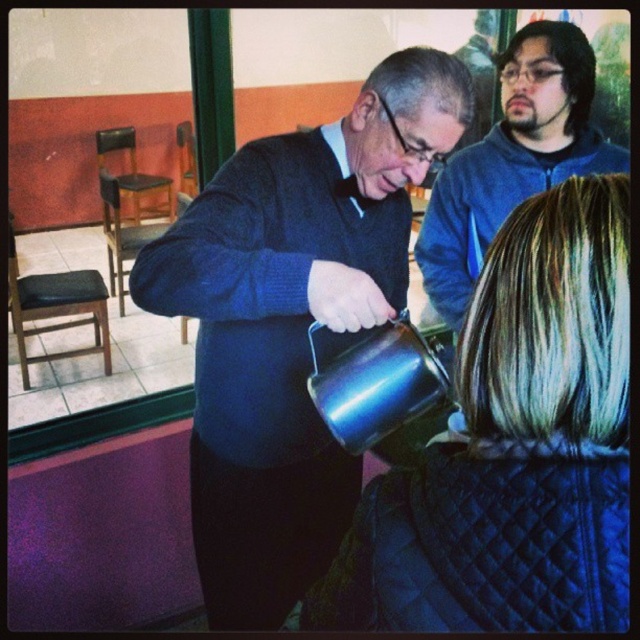
You are a customer at the cafe and want to reach the metallic blue kettle at center to pour yourself a drink. However, there is a black quilted jacket at lower right in the way. Can you easily access the kettle without moving the jacket?

The black quilted jacket at lower right is behind the metallic blue kettle at center, so you can easily access the metallic blue kettle at center without needing to move the jacket.

Based on the scene description, where is the metallic blue kettle at center located in terms of coordinates?

The metallic blue kettle at center is located at coordinates point (292,323).

You are a barista at this cafe and need to reach the metallic blue kettle at center to prepare a customer order. Considering your arm can extend 30 inches, can you comfortably reach the kettle without moving your position?

The metallic blue kettle at center is 36.40 inches away from the camera, which is beyond the 30 inches arm extension. Therefore, you cannot comfortably reach the kettle without moving your position.